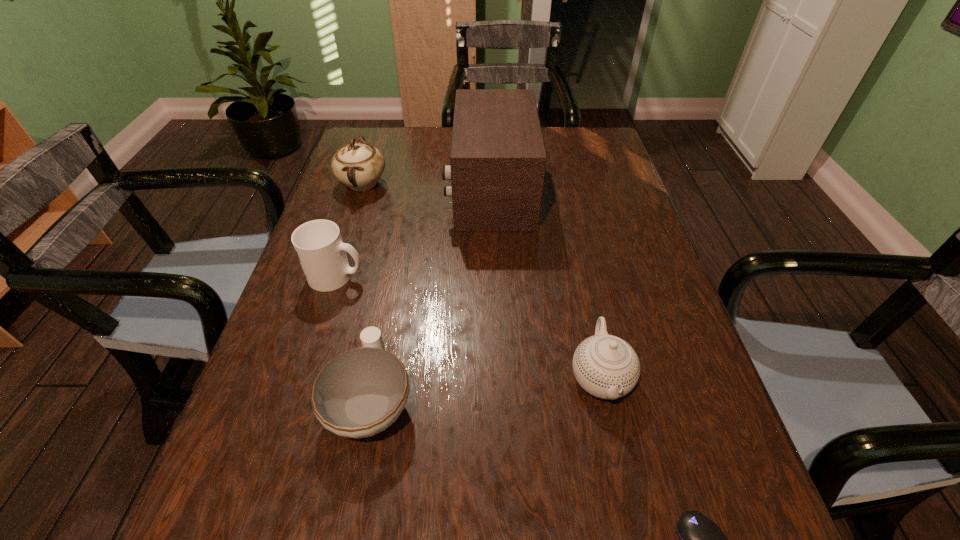
Identify the location of vacant region located 0.220m on the front of the tallest chinaware. (338, 260).

Identify the location of free spot located 0.160m on the handle side of the fourth nearest object. This screenshot has height=540, width=960. (436, 276).

Where is `free space located 0.160m on the spout of the second shortest chinaware`? The width and height of the screenshot is (960, 540). free space located 0.160m on the spout of the second shortest chinaware is located at coordinates (631, 519).

Locate an element on the screen. Image resolution: width=960 pixels, height=540 pixels. free region located 0.210m on the side with the handle of the second shortest object is located at coordinates (395, 276).

At what (x,y) coordinates should I click in order to perform the action: click on vacant space located 0.390m on the side with the handle of the second shortest object. Please return your answer as a coordinate pair (x, y). Looking at the image, I should click on (404, 226).

Find the location of `vacant space positioned on the side with the handle of the second shortest object`. vacant space positioned on the side with the handle of the second shortest object is located at coordinates (403, 228).

You are a GUI agent. You are given a task and a screenshot of the screen. Output one action in this format:
    pyautogui.click(x=<x>, y=<y>)
    Task: Click on the radio receiver that is at the far edge
    
    Given the screenshot: What is the action you would take?
    pos(497,167)

Identify the location of chinaware present at the far edge. (359, 166).

At what (x,y) coordinates should I click in order to perform the action: click on mug present at the left edge. Please return your answer as a coordinate pair (x, y). The height and width of the screenshot is (540, 960). Looking at the image, I should click on (318, 244).

The width and height of the screenshot is (960, 540). I want to click on object at the right edge, so click(605, 366).